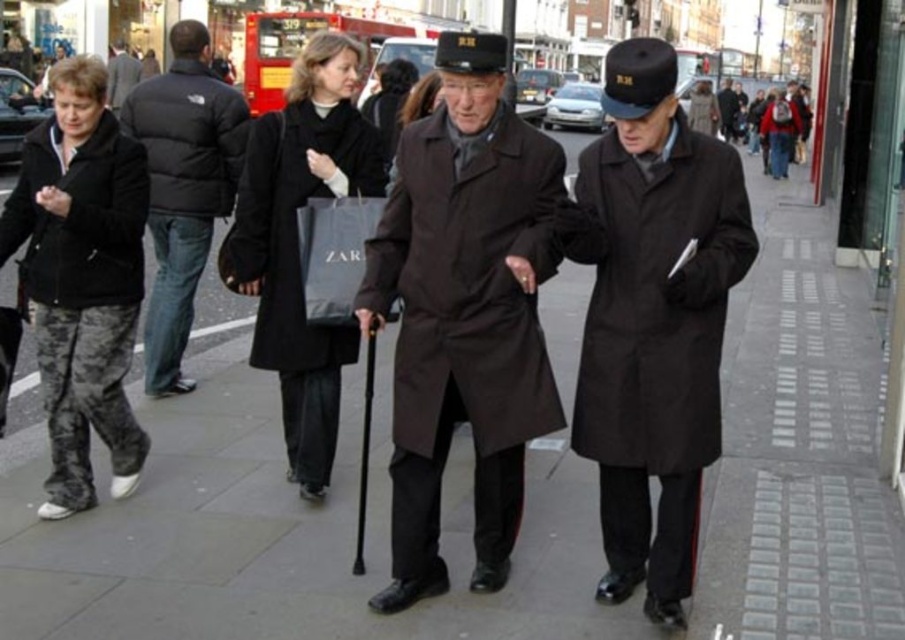
Question: Among these points, which one is farthest from the camera?

Choices:
 (A) (241, 164)
 (B) (681, 128)
 (C) (120, 45)

Answer: (C)

Question: Estimate the real-world distances between objects in this image. Which object is farther from the black puffer jacket at left?

Choices:
 (A) camouflage pants at lower left
 (B) matte black jacket at left
 (C) matte black coat at center

Answer: (C)

Question: Which object appears closest to the camera in this image?

Choices:
 (A) dark brown coat at center
 (B) matte brown coat at center

Answer: (B)

Question: Is camouflage pants at lower left wider than black matte jacket at left?

Choices:
 (A) no
 (B) yes

Answer: (A)

Question: Does matte black coat at center have a larger size compared to black matte jacket at left?

Choices:
 (A) yes
 (B) no

Answer: (A)

Question: Is black matte coat at center thinner than dark brown coat at center?

Choices:
 (A) yes
 (B) no

Answer: (A)